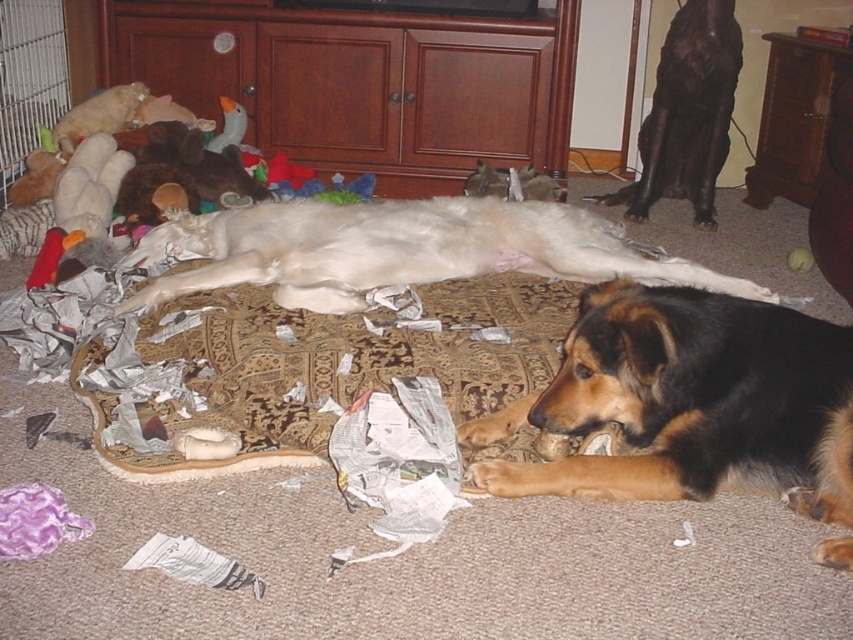
Question: In this image, where is brown fur dog at center located relative to white fur dog at center?

Choices:
 (A) above
 (B) below

Answer: (B)

Question: Which point is farther to the camera?

Choices:
 (A) (730, 365)
 (B) (323, 209)

Answer: (B)

Question: Is brown fur dog at center further to camera compared to white fur dog at center?

Choices:
 (A) no
 (B) yes

Answer: (A)

Question: Among these points, which one is nearest to the camera?

Choices:
 (A) (779, 388)
 (B) (315, 240)

Answer: (A)

Question: Is brown fur dog at center in front of white fur dog at center?

Choices:
 (A) yes
 (B) no

Answer: (A)